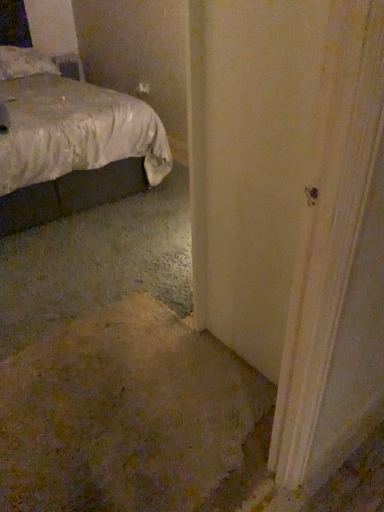
Question: Is the position of white fabric pillow at upper left more distant than that of white fabric bed at upper left?

Choices:
 (A) yes
 (B) no

Answer: (A)

Question: From the image's perspective, is white fabric pillow at upper left located beneath white fabric bed at upper left?

Choices:
 (A) yes
 (B) no

Answer: (B)

Question: Would you consider white fabric pillow at upper left to be distant from white fabric bed at upper left?

Choices:
 (A) yes
 (B) no

Answer: (B)

Question: Is white fabric pillow at upper left closer to camera compared to white fabric bed at upper left?

Choices:
 (A) no
 (B) yes

Answer: (A)

Question: Is the surface of white fabric pillow at upper left in direct contact with white fabric bed at upper left?

Choices:
 (A) no
 (B) yes

Answer: (A)

Question: From the image's perspective, is white fabric pillow at upper left on white fabric bed at upper left?

Choices:
 (A) yes
 (B) no

Answer: (A)

Question: From a real-world perspective, does white fabric bed at upper left stand above white fabric pillow at upper left?

Choices:
 (A) yes
 (B) no

Answer: (B)

Question: From the image's perspective, is white fabric bed at upper left on white fabric pillow at upper left?

Choices:
 (A) yes
 (B) no

Answer: (B)

Question: Considering the relative positions of white fabric bed at upper left and white fabric pillow at upper left in the image provided, is white fabric bed at upper left to the left of white fabric pillow at upper left from the viewer's perspective?

Choices:
 (A) no
 (B) yes

Answer: (A)

Question: Is white fabric bed at upper left thinner than white fabric pillow at upper left?

Choices:
 (A) no
 (B) yes

Answer: (A)

Question: Does white fabric bed at upper left have a greater width compared to white fabric pillow at upper left?

Choices:
 (A) no
 (B) yes

Answer: (B)

Question: Does white fabric bed at upper left lie in front of white fabric pillow at upper left?

Choices:
 (A) yes
 (B) no

Answer: (A)

Question: From a real-world perspective, is white fabric bed at upper left physically located above or below white fabric pillow at upper left?

Choices:
 (A) above
 (B) below

Answer: (B)